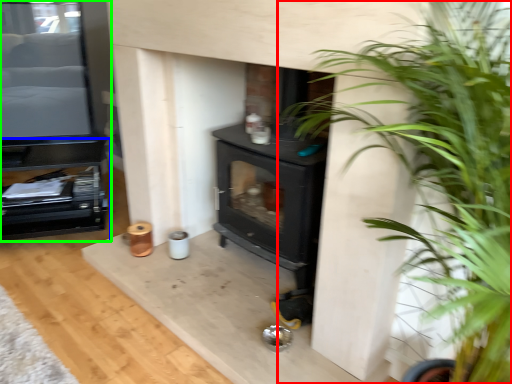
Question: Which object is the farthest from houseplant (highlighted by a red box)? Choose among these: entertainment center (highlighted by a blue box) or entertainment center (highlighted by a green box).

Choices:
 (A) entertainment center
 (B) entertainment center

Answer: (B)